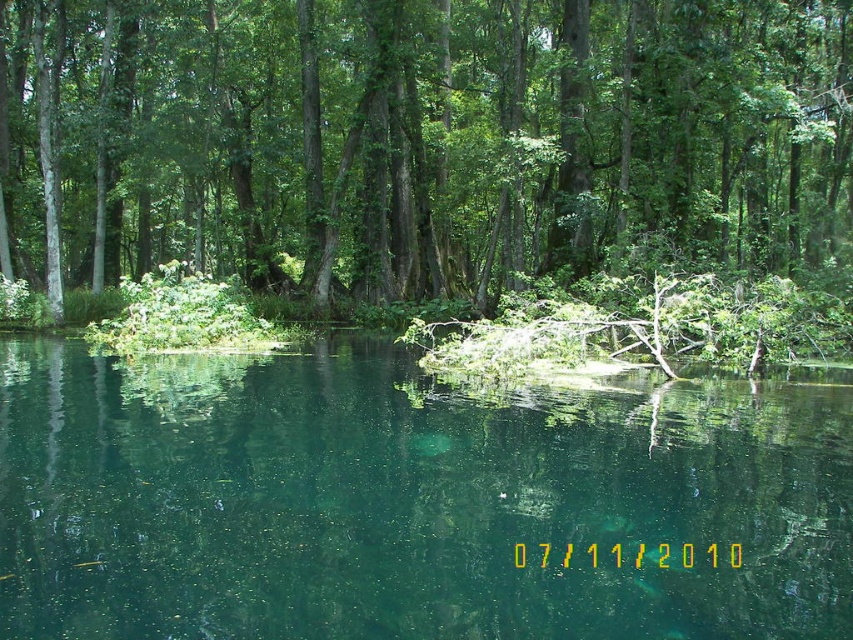
Question: From the image, what is the correct spatial relationship of green leafy tree at center in relation to green translucent water at center?

Choices:
 (A) below
 (B) above

Answer: (B)

Question: Is green leafy tree at center further to the viewer compared to green translucent water at center?

Choices:
 (A) yes
 (B) no

Answer: (A)

Question: Does green leafy tree at center come behind green translucent water at center?

Choices:
 (A) yes
 (B) no

Answer: (A)